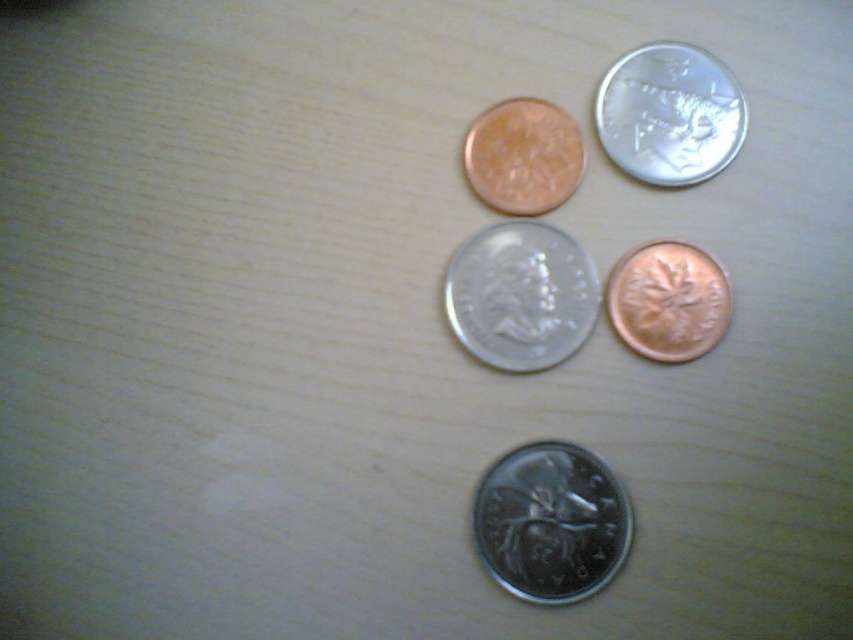
Question: Does satin silver coin at center appear on the right side of matte copper coin at upper center?

Choices:
 (A) no
 (B) yes

Answer: (A)

Question: Which point appears farthest from the camera in this image?

Choices:
 (A) (514, 100)
 (B) (621, 93)

Answer: (A)

Question: Which object is farther from the camera taking this photo?

Choices:
 (A) satin silver coin at center
 (B) matte copper coin at upper center

Answer: (B)

Question: Considering the relative positions of satin silver coin at center and matte copper coin at upper center in the image provided, where is satin silver coin at center located with respect to matte copper coin at upper center?

Choices:
 (A) left
 (B) right

Answer: (A)

Question: Is satin silver coin at center thinner than matte copper coin at upper center?

Choices:
 (A) yes
 (B) no

Answer: (B)

Question: Which object appears closest to the camera in this image?

Choices:
 (A) silver metallic coin at center
 (B) copper metallic coin at center-right

Answer: (A)